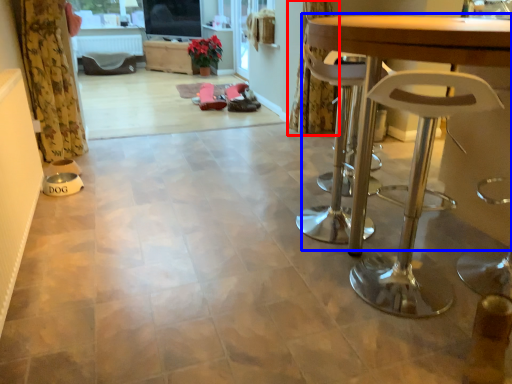
Question: Which of the following is the closest to the observer, curtain (highlighted by a red box) or table (highlighted by a blue box)?

Choices:
 (A) curtain
 (B) table

Answer: (B)